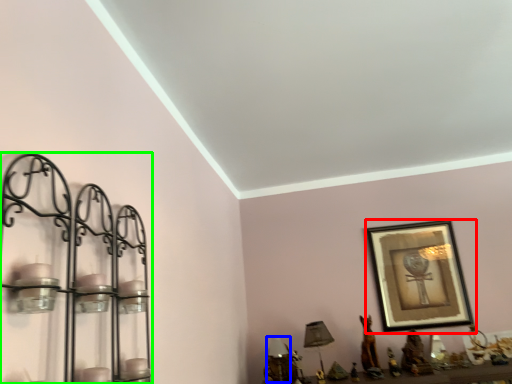
Question: Estimate the real-world distances between objects in this image. Which object is closer to picture frame (highlighted by a red box), table lamp (highlighted by a blue box) or shelf (highlighted by a green box)?

Choices:
 (A) table lamp
 (B) shelf

Answer: (A)